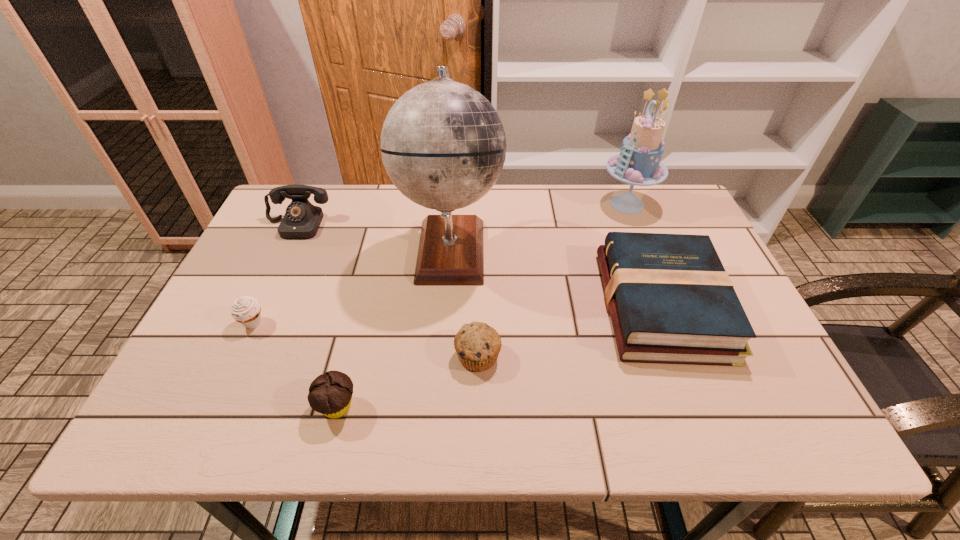
You are a GUI agent. You are given a task and a screenshot of the screen. Output one action in this format:
    pyautogui.click(x=<x>, y=<y>)
    Task: Click on the globe
    This screenshot has height=540, width=960.
    Given the screenshot: What is the action you would take?
    pyautogui.click(x=443, y=145)

Find the location of `cake`. cake is located at coordinates (639, 163).

Locate an element on the screen. the fifth shortest object is located at coordinates (302, 219).

Image resolution: width=960 pixels, height=540 pixels. Identify the location of hardback book. (671, 301).

The image size is (960, 540). I want to click on the leftmost muffin, so click(246, 310).

You are a GUI agent. You are given a task and a screenshot of the screen. Output one action in this format:
    pyautogui.click(x=<x>, y=<y>)
    Task: Click on the rightmost muffin
    
    Given the screenshot: What is the action you would take?
    pyautogui.click(x=477, y=344)

You are a GUI agent. You are given a task and a screenshot of the screen. Output one action in this format:
    pyautogui.click(x=<x>, y=<y>)
    Task: Click on the nearest muffin
    
    Given the screenshot: What is the action you would take?
    pyautogui.click(x=330, y=394)

Find the location of a particular element. the second muffin from right to left is located at coordinates (330, 394).

Image resolution: width=960 pixels, height=540 pixels. I want to click on vacant space located at the equator of the globe, so click(636, 248).

Locate an element on the screen. The image size is (960, 540). vacant space situated 0.220m with a ladder on the side of the second tallest object is located at coordinates click(529, 204).